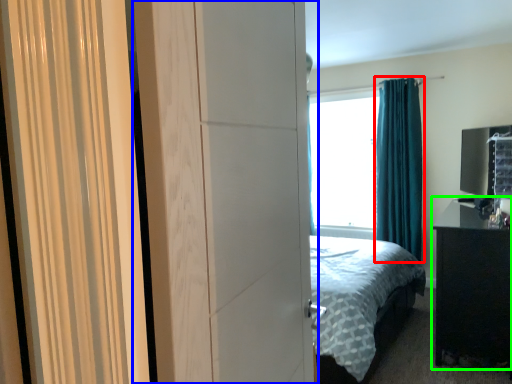
Question: Based on their relative distances, which object is farther from curtain (highlighted by a red box)? Choose from screen door (highlighted by a blue box) and nightstand (highlighted by a green box).

Choices:
 (A) screen door
 (B) nightstand

Answer: (A)